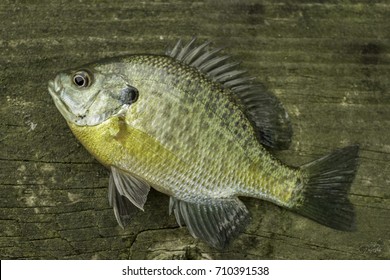
You are a GUI agent. You are given a task and a screenshot of the screen. Output one action in this format:
    pyautogui.click(x=<x>, y=<y>)
    Task: Click on the wooden surface
    
    Given the screenshot: What is the action you would take?
    pyautogui.click(x=307, y=66)